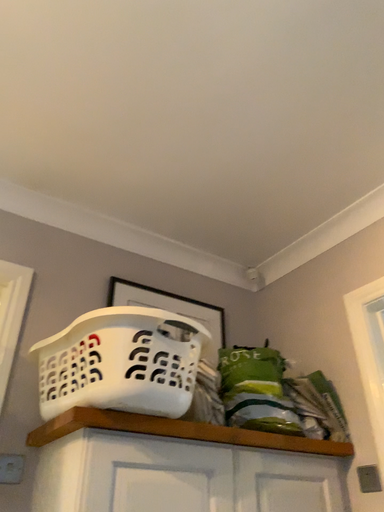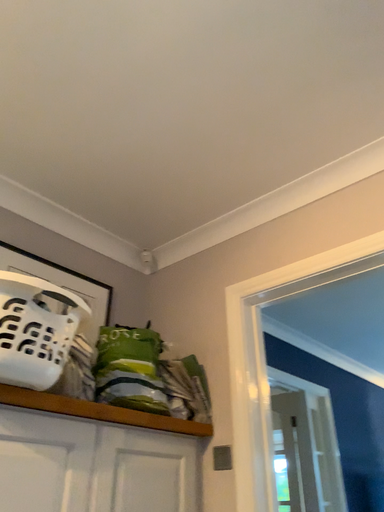
Question: Which way did the camera rotate in the video?

Choices:
 (A) rotated left
 (B) rotated right

Answer: (B)